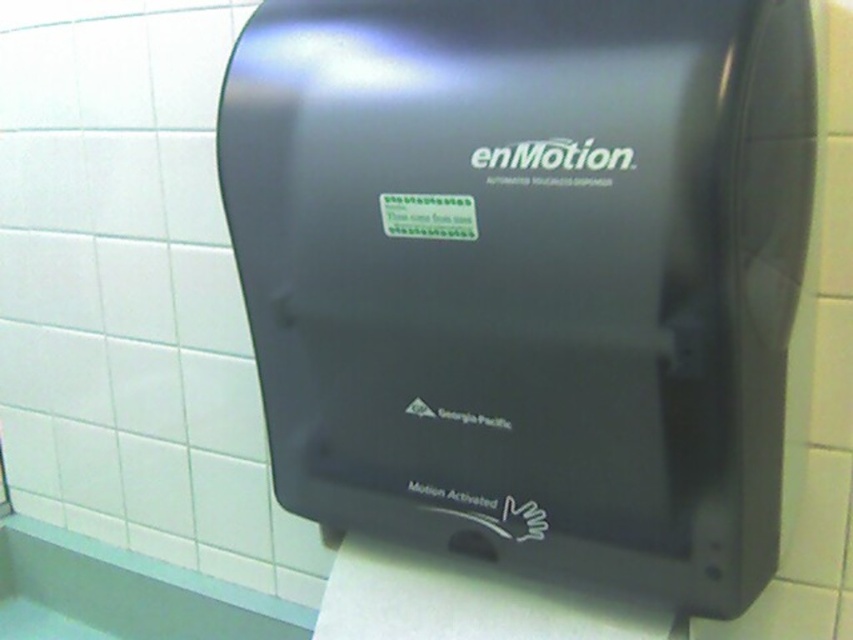
Between black plastic hand dryer at center and white matte toilet paper at lower center, which one is positioned lower?

Positioned lower is white matte toilet paper at lower center.

How much distance is there between black plastic hand dryer at center and white matte toilet paper at lower center?

18.33 centimeters

Describe the element at coordinates (527, 275) in the screenshot. I see `black plastic hand dryer at center` at that location.

Find the location of a particular element. The width and height of the screenshot is (853, 640). black plastic hand dryer at center is located at coordinates (527, 275).